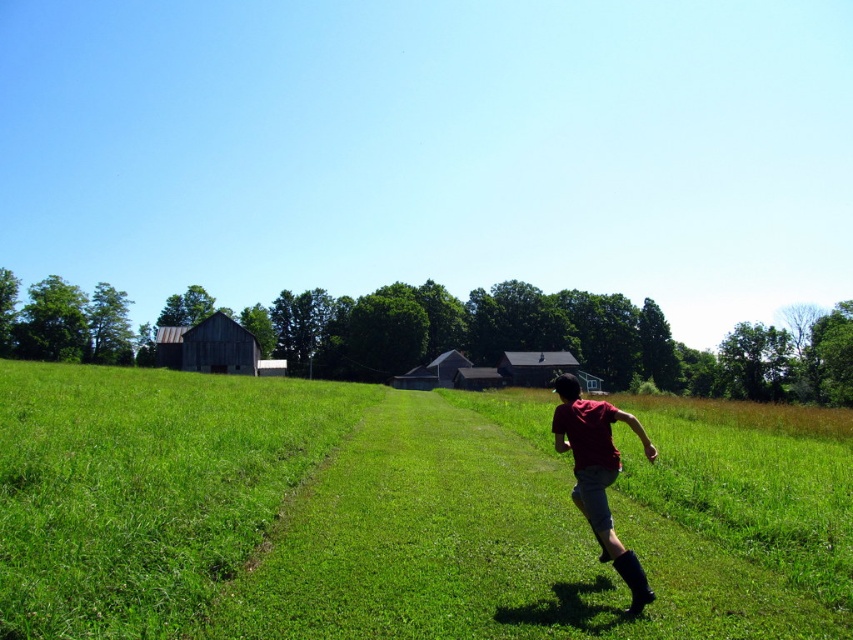
In the scene shown: You are standing at the point labeled as point (392, 515) in the image. Looking around, you see the green grassy field at center. What is directly under your feet at this point?

The green grassy field at center is located at point (392, 515), so the ground under your feet is part of the green grassy field at center.

You are standing at the origin point in the middle of the field. A drone is flying above you and needs to drop a package at the green grassy field at center. What are the coordinates where the drone should drop the package?

The drone should drop the package at coordinates point (392, 515) where the green grassy field at center is located.